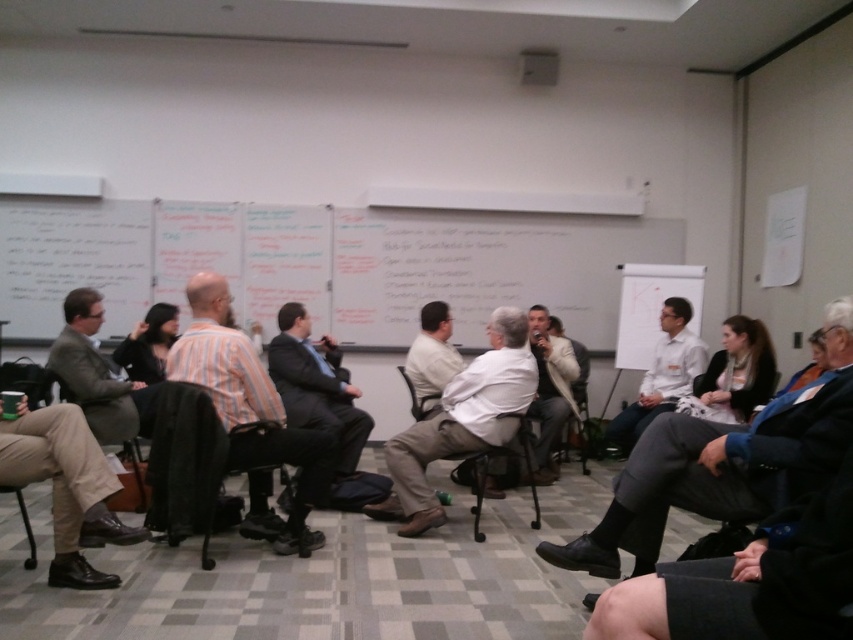
Question: Is black fabric chair at center below white matte shirt at center?

Choices:
 (A) yes
 (B) no

Answer: (A)

Question: Does white matte shirt at center come behind wooden chair at center?

Choices:
 (A) no
 (B) yes

Answer: (A)

Question: Observing the image, what is the correct spatial positioning of matte gray suit at left in reference to light beige shirt at center?

Choices:
 (A) left
 (B) right

Answer: (A)

Question: Which is nearer to the tan fabric chair at lower left?

Choices:
 (A) white shirt at center
 (B) dark suit at center
 (C) wooden chair at center
 (D) light beige shirt at center

Answer: (B)

Question: Based on their relative distances, which object is nearer to the white shirt at center?

Choices:
 (A) light beige shirt at center
 (B) tan fabric chair at lower left

Answer: (A)

Question: Which object appears closest to the camera in this image?

Choices:
 (A) white matte shirt at center
 (B) wooden chair at center
 (C) striped cotton shirt at center
 (D) matte gray suit at left

Answer: (C)